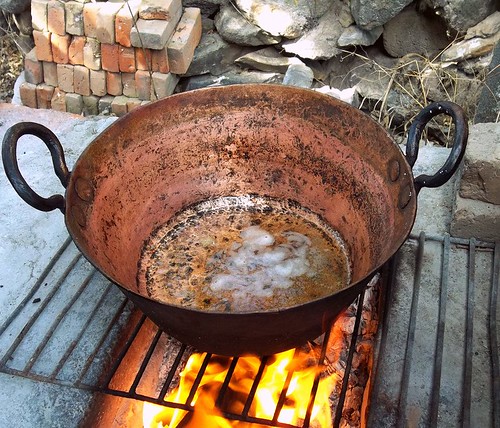
Find the location of a particular element. front side of bowl is located at coordinates pos(236,332).